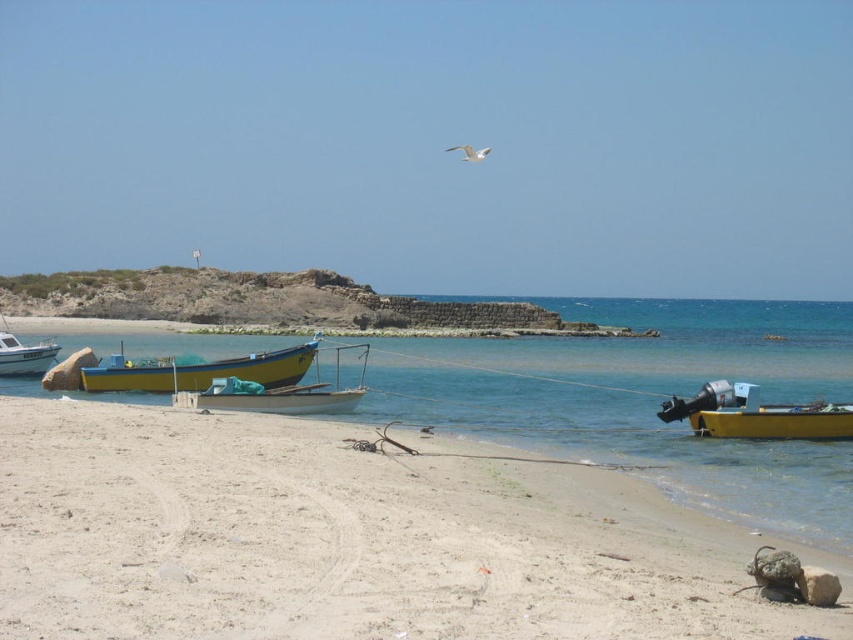
Question: Considering the relative positions of yellow matte boat at lower right and wooden boat at center in the image provided, where is yellow matte boat at lower right located with respect to wooden boat at center?

Choices:
 (A) above
 (B) below

Answer: (B)

Question: Which point is farther from the camera taking this photo?

Choices:
 (A) (7, 326)
 (B) (689, 620)
 (C) (161, 388)
 (D) (279, 400)

Answer: (A)

Question: Is white sandy beach at lower left thinner than white glossy boat at left?

Choices:
 (A) no
 (B) yes

Answer: (A)

Question: Which is nearer to the yellow matte boat at left?

Choices:
 (A) yellow matte boat at lower right
 (B) white sandy beach at lower left
 (C) wooden boat at center
 (D) white glossy boat at left

Answer: (C)

Question: Does yellow matte boat at lower right lie in front of white glossy boat at left?

Choices:
 (A) no
 (B) yes

Answer: (B)

Question: Among these points, which one is farthest from the camera?

Choices:
 (A) (45, 346)
 (B) (260, 408)

Answer: (A)